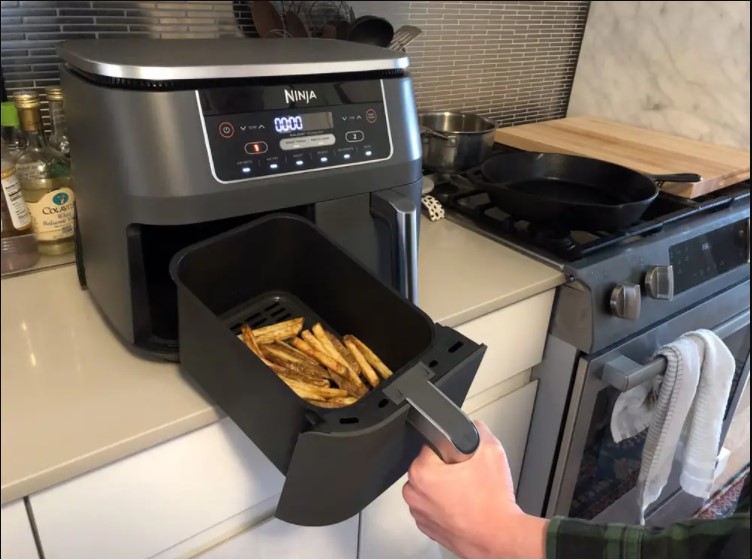
Find the location of `frying pan`. frying pan is located at coordinates (587, 210).